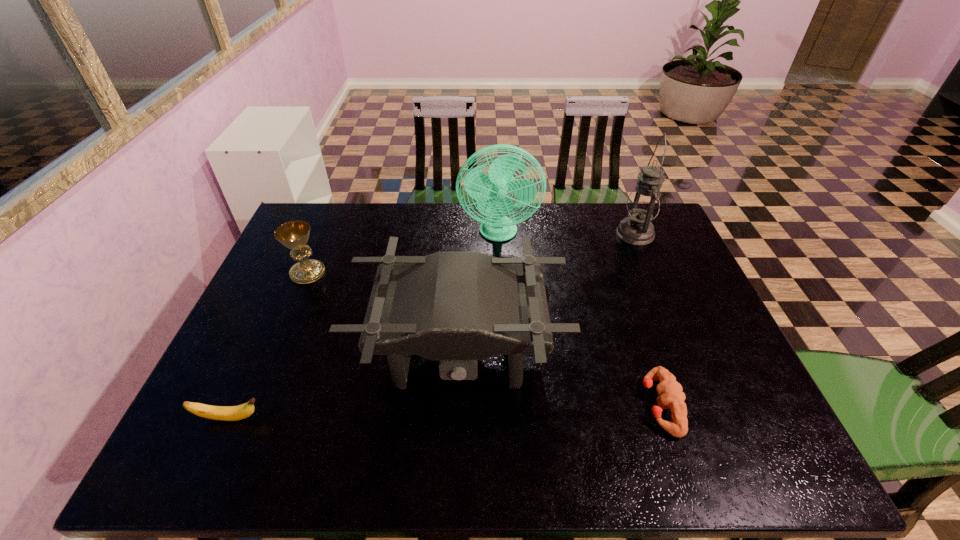
This screenshot has height=540, width=960. What are the coordinates of `banana that is positioned at the left edge` in the screenshot? It's located at (223, 413).

The image size is (960, 540). In order to click on object that is at the right edge in this screenshot , I will do `click(643, 204)`.

Image resolution: width=960 pixels, height=540 pixels. What are the coordinates of `object that is at the far right corner` in the screenshot? It's located at (643, 204).

Identify the location of free location at the far edge. The height and width of the screenshot is (540, 960). (457, 237).

I want to click on free region at the near edge of the desktop, so click(x=707, y=462).

Identify the location of free space at the left edge. The width and height of the screenshot is (960, 540). (293, 293).

This screenshot has height=540, width=960. I want to click on free space at the right edge, so click(x=700, y=325).

I want to click on vacant position at the far left corner of the desktop, so pyautogui.click(x=330, y=234).

At what (x,y) coordinates should I click in order to perform the action: click on vacant region between the fan and the third shortest object. Please return your answer as a coordinate pair (x, y). The width and height of the screenshot is (960, 540). Looking at the image, I should click on (403, 253).

This screenshot has height=540, width=960. I want to click on free space that is in between the third shortest object and the banana, so [x=269, y=346].